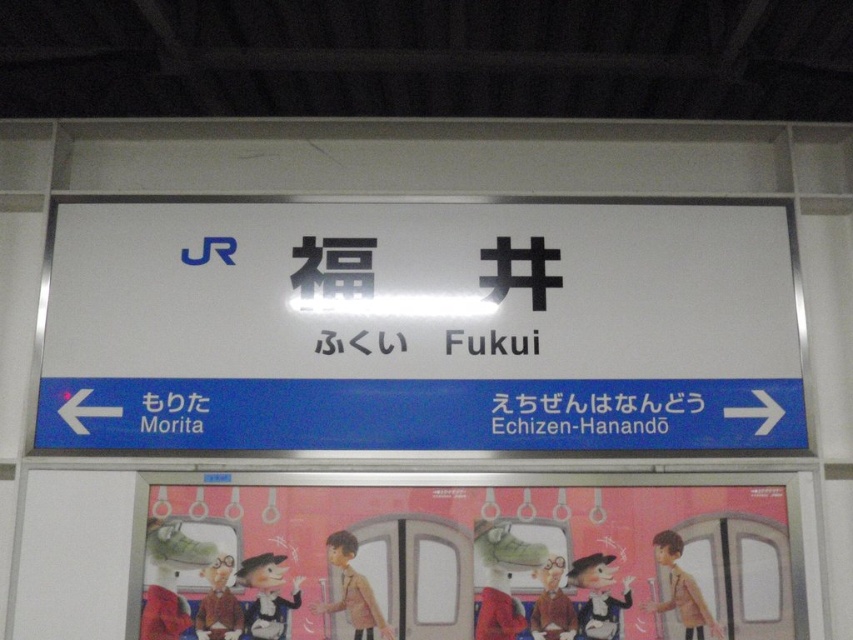
You are standing in front of the station signboard and need to determine which object is wider. Which one has a greater width between the white plastic sign at center and the cartoon characters at center?

The white plastic sign at center has a greater width than the cartoon characters at center.

You are standing at the station and want to know if there is enough space between the white plastic sign at center and the cartoon characters at center to place a 12 inch ruler horizontally. Can you fit it there?

The distance between the white plastic sign at center and the cartoon characters at center is 16.32 inches, which is greater than 12 inches, so yes, the ruler can fit horizontally between them.

You are standing at the station signboard at Fukui station. You see two points marked on the signboard. One is at point coordinates point [635,344] and the other is at point [270,564]. From your perspective, which point is closer to you?

Point [270,564] is closer to you because point [635,344] is behind point [270,564].